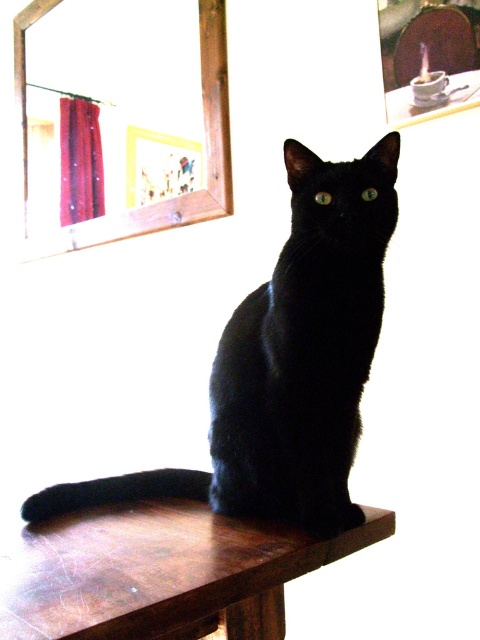
Question: Can you confirm if black glossy cat at center is wider than wooden table at center?

Choices:
 (A) yes
 (B) no

Answer: (A)

Question: Is black glossy cat at center positioned behind wooden table at center?

Choices:
 (A) yes
 (B) no

Answer: (A)

Question: Can you confirm if black glossy cat at center is thinner than wooden table at center?

Choices:
 (A) yes
 (B) no

Answer: (B)